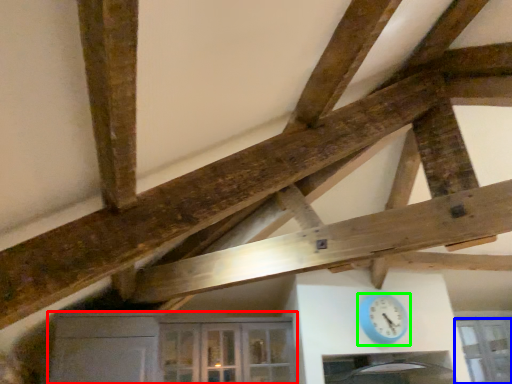
Question: Considering the real-world distances, which object is farthest from cabinetry (highlighted by a red box)? window (highlighted by a blue box) or clock (highlighted by a green box)?

Choices:
 (A) window
 (B) clock

Answer: (A)